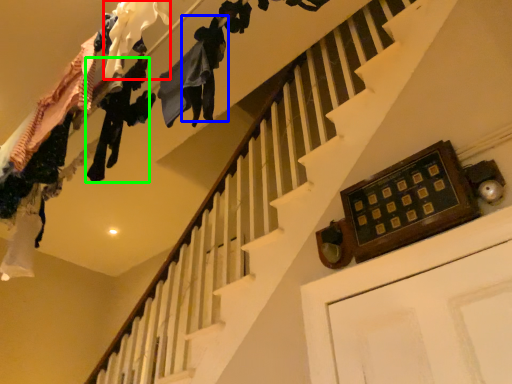
Question: Estimate the real-world distances between objects in this image. Which object is farther from clothing (highlighted by a red box), clothing (highlighted by a blue box) or clothing (highlighted by a green box)?

Choices:
 (A) clothing
 (B) clothing

Answer: (B)